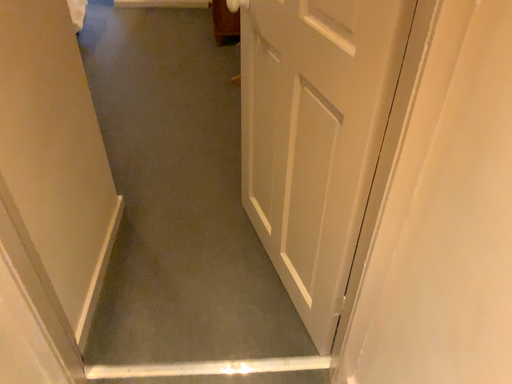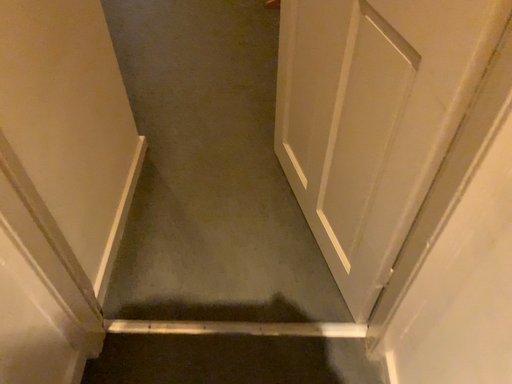
Question: How did the camera likely rotate when shooting the video?

Choices:
 (A) rotated upward
 (B) rotated downward

Answer: (B)